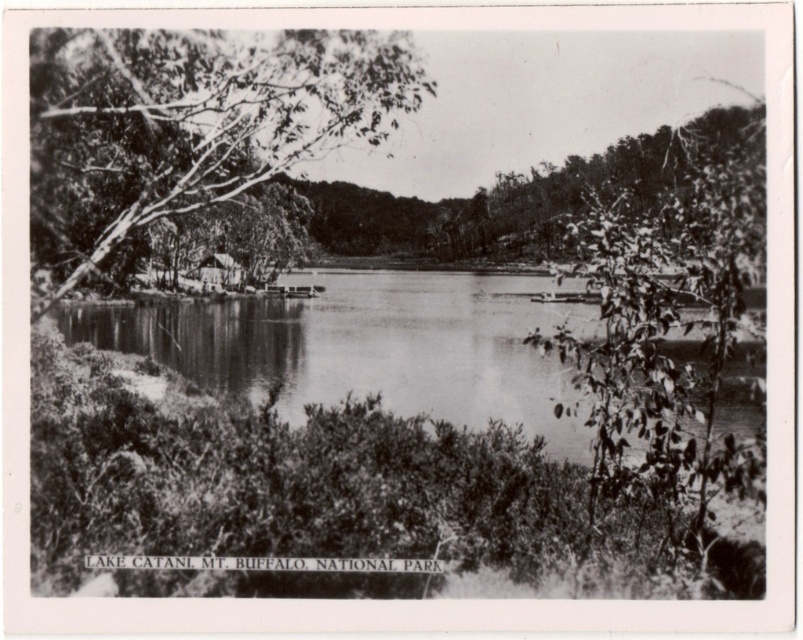
Question: Which point is farther from the camera taking this photo?

Choices:
 (A) (204, 262)
 (B) (382, 92)
 (C) (337, 275)

Answer: (C)

Question: Can you confirm if smooth bark tree at left is wider than smooth water at center?

Choices:
 (A) no
 (B) yes

Answer: (A)

Question: Among these points, which one is nearest to the camera?

Choices:
 (A) (528, 394)
 (B) (335, 132)

Answer: (B)

Question: Considering the real-world distances, which object is farthest from the wooden cabin at center?

Choices:
 (A) smooth water at center
 (B) smooth bark tree at left

Answer: (B)

Question: Does smooth water at center appear over wooden cabin at center?

Choices:
 (A) no
 (B) yes

Answer: (A)

Question: Is smooth water at center below wooden cabin at center?

Choices:
 (A) no
 (B) yes

Answer: (B)